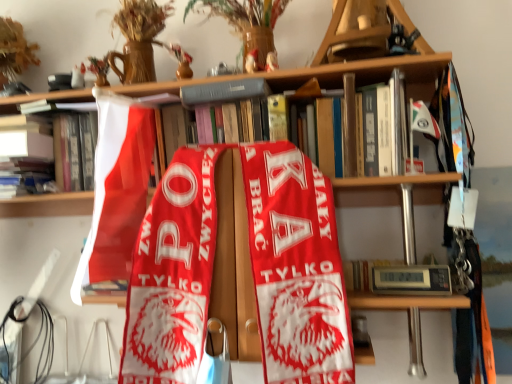
Question: Which direction should I rotate to look at hardcover book at upper center, the first book in the right-to-left sequence, — up or down?

Choices:
 (A) down
 (B) up

Answer: (B)

Question: Is red fabric scarf at center a part of matte white book at upper left, the third book when ordered from right to left?

Choices:
 (A) no
 (B) yes

Answer: (A)

Question: Is matte white book at upper left, the third book when ordered from right to left, oriented towards red fabric scarf at center?

Choices:
 (A) yes
 (B) no

Answer: (B)

Question: Can you confirm if matte white book at upper left, which appears as the 1th book when viewed from the left, is shorter than red fabric scarf at center?

Choices:
 (A) no
 (B) yes

Answer: (B)

Question: Does matte white book at upper left, the third book when ordered from right to left, have a greater width compared to red fabric scarf at center?

Choices:
 (A) yes
 (B) no

Answer: (A)

Question: Considering the relative positions of matte white book at upper left, the third book when ordered from right to left, and red fabric scarf at center in the image provided, is matte white book at upper left, the third book when ordered from right to left, to the right of red fabric scarf at center from the viewer's perspective?

Choices:
 (A) yes
 (B) no

Answer: (B)

Question: From the image's perspective, does matte white book at upper left, which appears as the 1th book when viewed from the left, appear higher than red fabric scarf at center?

Choices:
 (A) no
 (B) yes

Answer: (B)

Question: Does hardcover book at upper center, acting as the 2th book starting from the right, appear on the left side of red fabric scarf at center?

Choices:
 (A) no
 (B) yes

Answer: (B)

Question: Is there a large distance between hardcover book at upper center, which is the second book from left to right, and red fabric scarf at center?

Choices:
 (A) yes
 (B) no

Answer: (B)

Question: From a real-world perspective, is hardcover book at upper center, which is the second book from left to right, beneath red fabric scarf at center?

Choices:
 (A) no
 (B) yes

Answer: (A)

Question: From the image's perspective, would you say hardcover book at upper center, acting as the 2th book starting from the right, is shown under red fabric scarf at center?

Choices:
 (A) no
 (B) yes

Answer: (A)

Question: Does hardcover book at upper center, which is the second book from left to right, have a greater width compared to red fabric scarf at center?

Choices:
 (A) yes
 (B) no

Answer: (A)

Question: From a real-world perspective, does hardcover book at upper center, acting as the 2th book starting from the right, stand above red fabric scarf at center?

Choices:
 (A) yes
 (B) no

Answer: (A)

Question: Is red fabric scarf at center placed right next to hardcover book at upper center, the first book in the right-to-left sequence?

Choices:
 (A) yes
 (B) no

Answer: (B)